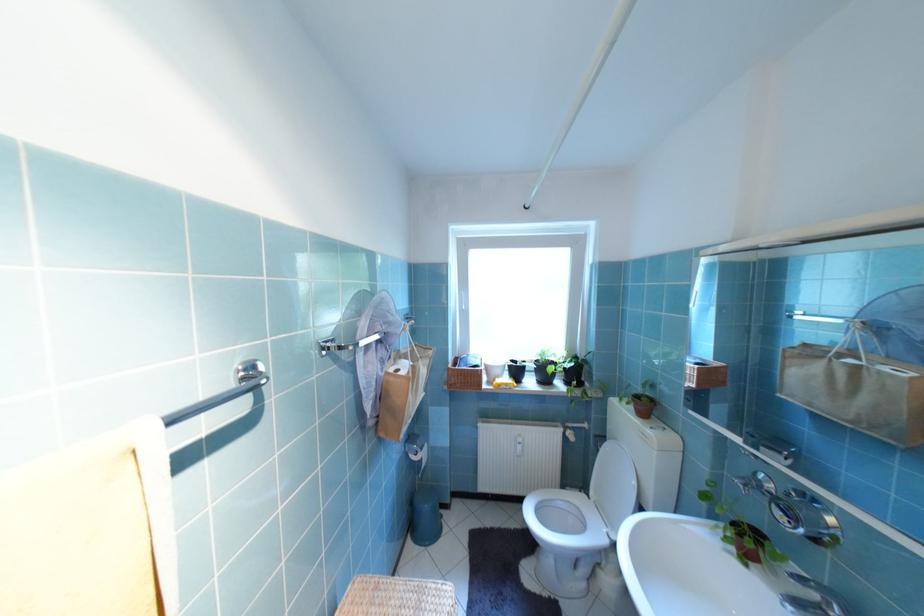
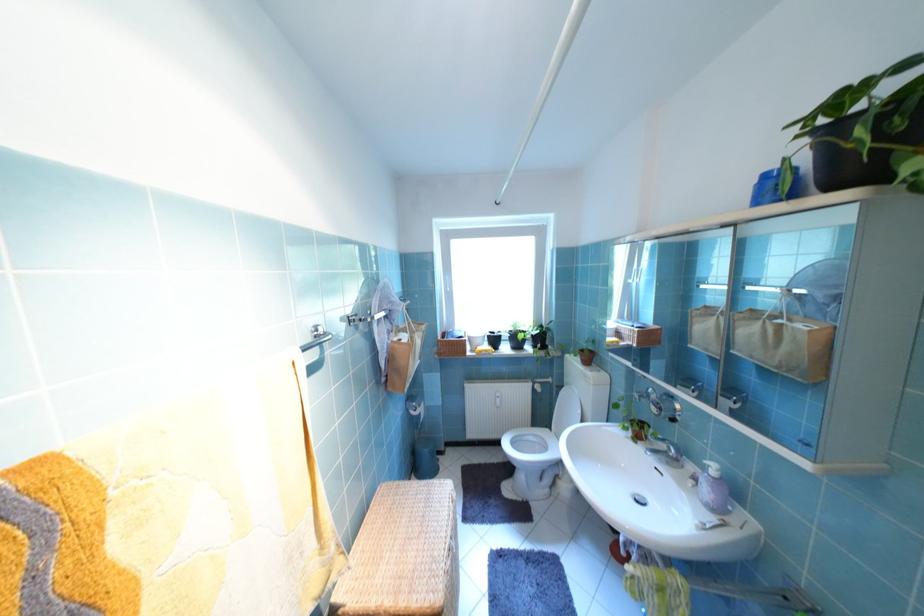
In the second image, find the point that corresponds to (540,383) in the first image.

(515, 349)